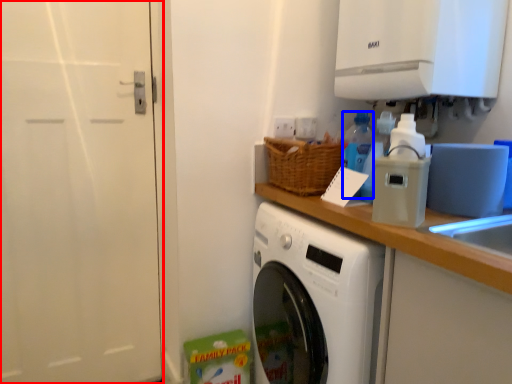
Question: Which object appears farthest to the camera in this image, screen door (highlighted by a red box) or bottle (highlighted by a blue box)?

Choices:
 (A) screen door
 (B) bottle

Answer: (B)